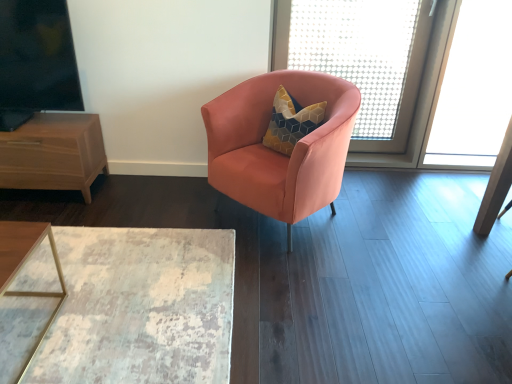
Where is `vacant area that is situated to the right of satin peach armchair at center`? vacant area that is situated to the right of satin peach armchair at center is located at coordinates (389, 238).